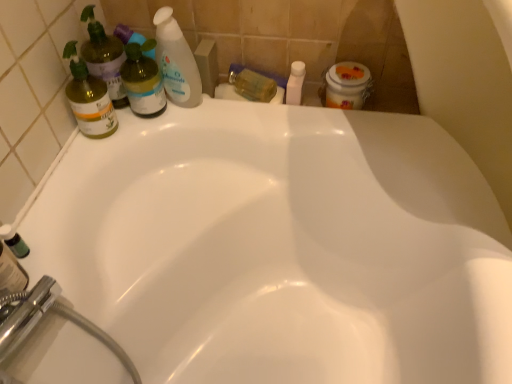
Question: Is green glass spray bottle at left, the 3th cleaning product from the right, taller than matte green bottle at left, the 2th cleaning product from the left?

Choices:
 (A) no
 (B) yes

Answer: (A)

Question: Would you say green glass spray bottle at left, the 3th cleaning product from the right, contains matte green bottle at left, the 2th cleaning product from the left?

Choices:
 (A) yes
 (B) no

Answer: (B)

Question: From the image's perspective, is green glass spray bottle at left, the first cleaning product positioned from the left, above matte green bottle at left, the 2th cleaning product from the left?

Choices:
 (A) yes
 (B) no

Answer: (B)

Question: Is green glass spray bottle at left, the first cleaning product positioned from the left, smaller than matte green bottle at left, which is counted as the 2th cleaning product, starting from the right?

Choices:
 (A) yes
 (B) no

Answer: (A)

Question: Is green glass spray bottle at left, the 3th cleaning product from the right, oriented away from matte green bottle at left, the 2th cleaning product from the left?

Choices:
 (A) no
 (B) yes

Answer: (B)

Question: From a real-world perspective, is green glass spray bottle at left, the 3th cleaning product from the right, below matte green bottle at left, the 2th cleaning product from the left?

Choices:
 (A) yes
 (B) no

Answer: (A)

Question: Is green glass spray bottle at left, the first cleaning product positioned from the left, to the left of white plastic bottle at upper center, the second toiletry in the left-to-right sequence, from the viewer's perspective?

Choices:
 (A) yes
 (B) no

Answer: (A)

Question: From the image's perspective, is green glass spray bottle at left, the first cleaning product positioned from the left, below white plastic bottle at upper center, acting as the 1th toiletry starting from the right?

Choices:
 (A) no
 (B) yes

Answer: (B)

Question: Is green glass spray bottle at left, the 3th cleaning product from the right, further to the viewer compared to white plastic bottle at upper center, the second toiletry in the left-to-right sequence?

Choices:
 (A) no
 (B) yes

Answer: (A)

Question: Does green glass spray bottle at left, the 3th cleaning product from the right, have a greater height compared to white plastic bottle at upper center, acting as the 1th toiletry starting from the right?

Choices:
 (A) no
 (B) yes

Answer: (B)

Question: Considering the relative sizes of green glass spray bottle at left, the 3th cleaning product from the right, and white plastic bottle at upper center, acting as the 1th toiletry starting from the right, in the image provided, is green glass spray bottle at left, the 3th cleaning product from the right, bigger than white plastic bottle at upper center, acting as the 1th toiletry starting from the right,?

Choices:
 (A) yes
 (B) no

Answer: (A)

Question: Is green glass spray bottle at left, the 3th cleaning product from the right, positioned in front of white plastic bottle at upper center, acting as the 1th toiletry starting from the right?

Choices:
 (A) no
 (B) yes

Answer: (B)

Question: Does white plastic bottle at upper center, acting as the 1th toiletry starting from the right, contain translucent plastic bottle at upper left, placed as the third cleaning product when sorted from left to right?

Choices:
 (A) yes
 (B) no

Answer: (B)